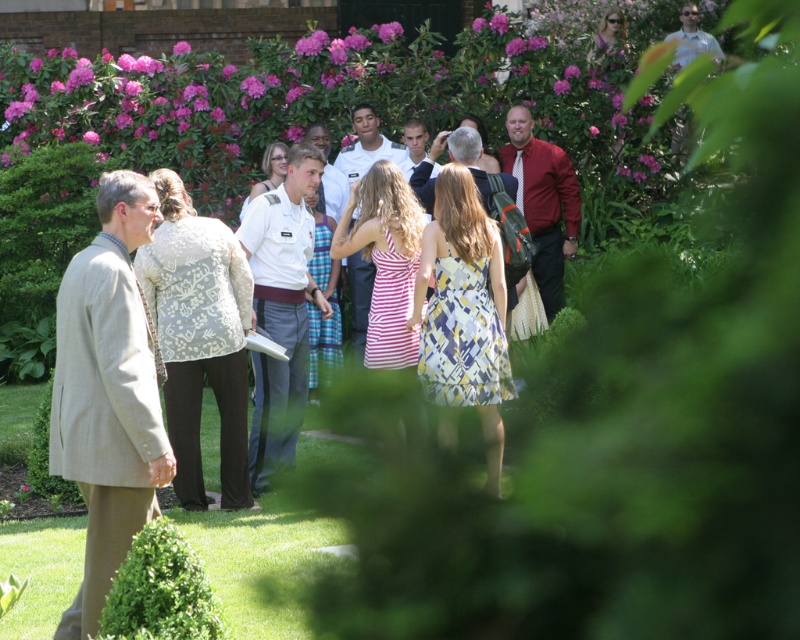
Question: Which of the following is the closest to the observer?

Choices:
 (A) matte red shirt at center
 (B) beige textured blazer at left

Answer: (B)

Question: Is white uniform at center positioned in front of light blue uniform at center?

Choices:
 (A) no
 (B) yes

Answer: (B)

Question: Does beige textured blazer at left have a greater width compared to white uniform at center?

Choices:
 (A) yes
 (B) no

Answer: (A)

Question: Can you confirm if beige textured blazer at left is positioned to the left of matte red shirt at center?

Choices:
 (A) yes
 (B) no

Answer: (A)

Question: Which object is positioned farthest from the light blue uniform at center?

Choices:
 (A) beige textured blazer at left
 (B) matte red shirt at center

Answer: (A)

Question: Based on their relative distances, which object is farther from the white uniform shirt at center?

Choices:
 (A) matte red shirt at center
 (B) light blue uniform at center
 (C) white uniform at center
 (D) beige textured blazer at left

Answer: (D)